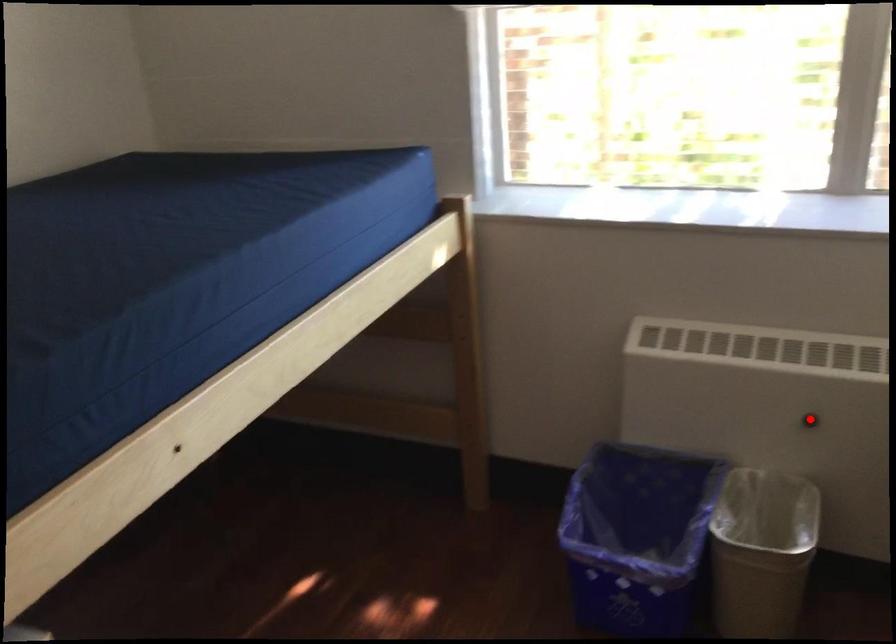
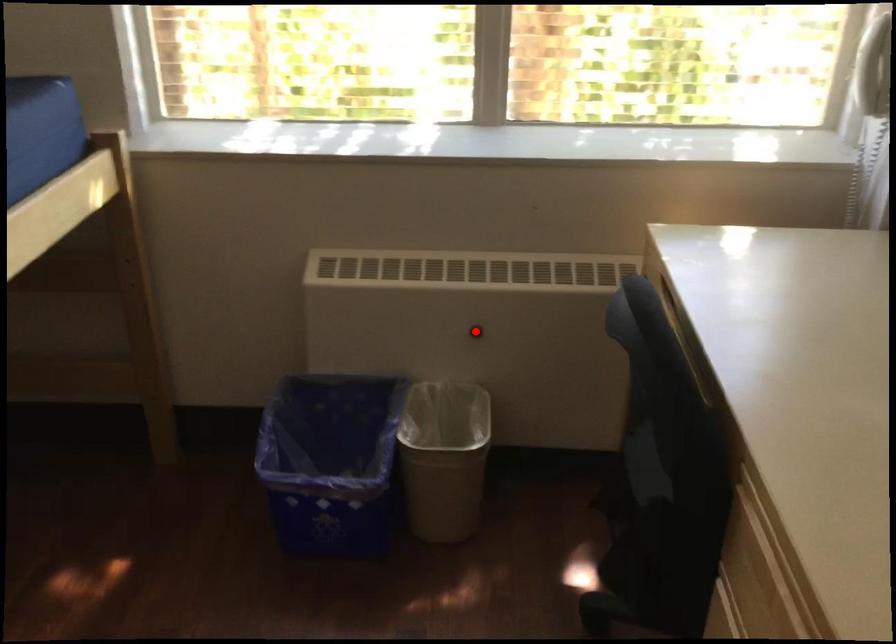
I am providing you with two images of the same scene from different viewpoints. A red point is marked on the first image and another point is marked on the second image. Do the highlighted points in image1 and image2 indicate the same real-world spot?

Yes